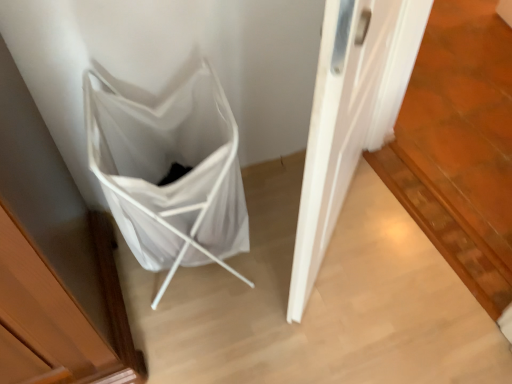
Where is `free space in front of white matte door at center`? free space in front of white matte door at center is located at coordinates (358, 320).